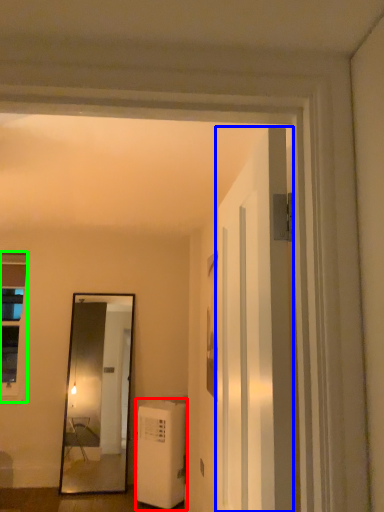
Question: Estimate the real-world distances between objects in this image. Which object is farther from air conditioner (highlighted by a red box), door (highlighted by a blue box) or window (highlighted by a green box)?

Choices:
 (A) door
 (B) window

Answer: (A)